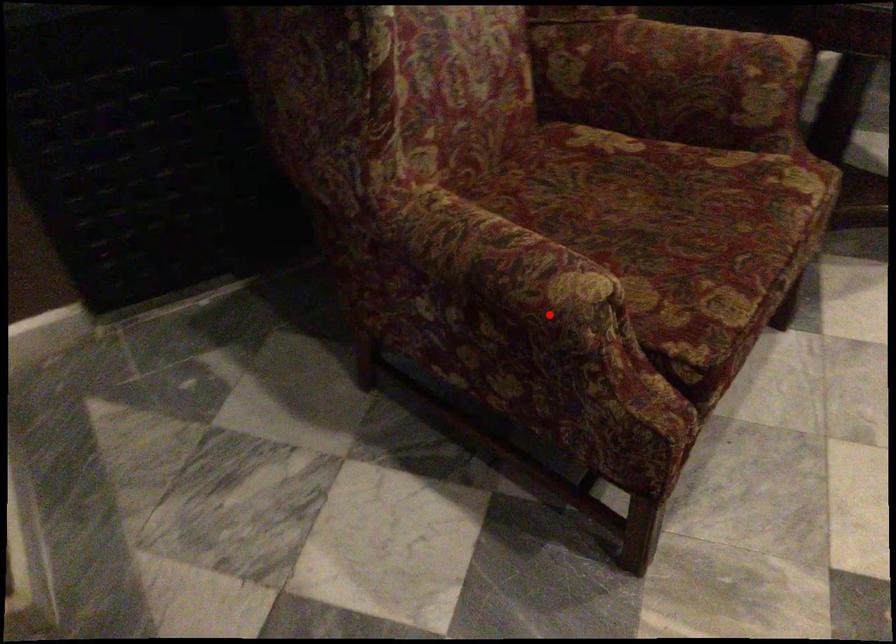
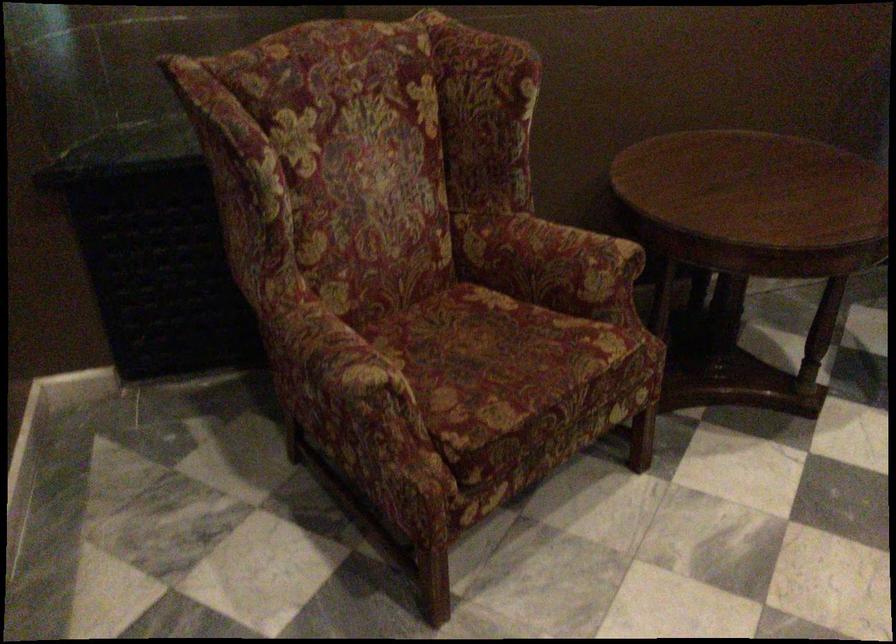
The point at the highlighted location is marked in the first image. Where is the corresponding point in the second image?

(343, 389)